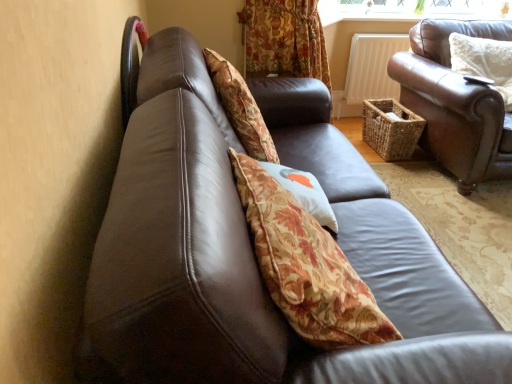
Question: Do you think brown leather couch at right is within white fluffy pillow at upper right, positioned as the 1th pillow in back-to-front order, or outside of it?

Choices:
 (A) inside
 (B) outside

Answer: (B)

Question: Is brown leather couch at right taller or shorter than white fluffy pillow at upper right, placed as the 2th pillow when sorted from front to back?

Choices:
 (A) short
 (B) tall

Answer: (B)

Question: Considering the real-world distances, which object is farthest from the brown leather couch at right?

Choices:
 (A) shiny black chair at upper left
 (B) white fluffy pillow at upper right, placed as the 2th pillow when sorted from front to back
 (C) floral fabric cushion at center, the 1th pillow ordered from the bottom

Answer: (A)

Question: Which is nearer to the white fluffy pillow at upper right, positioned as the 1th pillow in back-to-front order?

Choices:
 (A) floral fabric cushion at center, which appears as the second pillow when viewed from the back
 (B) brown leather couch at right
 (C) shiny black chair at upper left

Answer: (B)